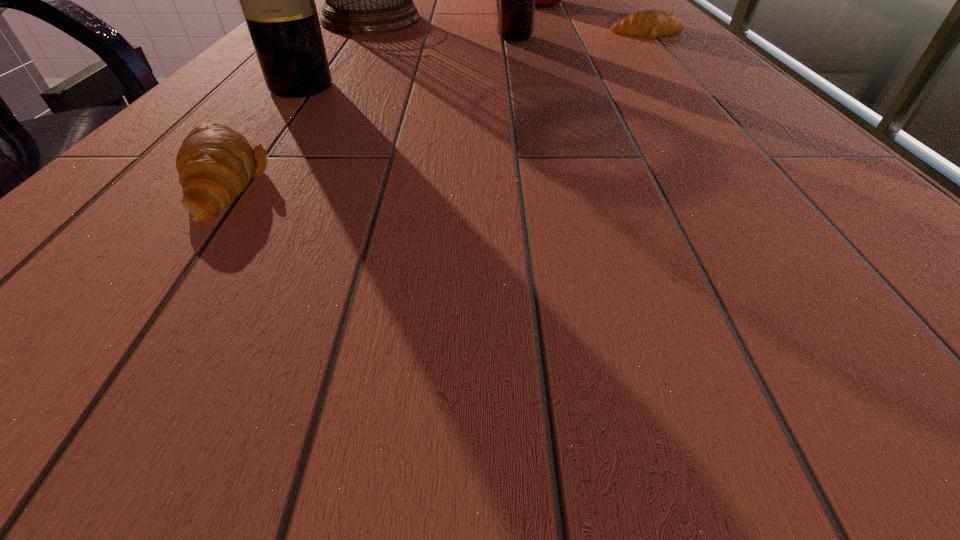
Where is `vacant space at the right edge of the desktop`? vacant space at the right edge of the desktop is located at coordinates (660, 50).

The width and height of the screenshot is (960, 540). I want to click on free space between the birdcage and the beer bottle, so click(x=443, y=29).

Where is `vacant space in between the beer bottle and the nearer crescent roll`? vacant space in between the beer bottle and the nearer crescent roll is located at coordinates (369, 110).

Find the location of a particular element. unoccupied position between the nearer crescent roll and the liquor is located at coordinates (261, 134).

Locate an element on the screen. This screenshot has height=540, width=960. free spot between the liquor and the right crescent roll is located at coordinates (475, 61).

The width and height of the screenshot is (960, 540). Identify the location of empty location between the shorter crescent roll and the beer bottle. (583, 37).

The image size is (960, 540). In order to click on the fifth closest object to the beer bottle in this screenshot , I will do `click(215, 163)`.

The width and height of the screenshot is (960, 540). I want to click on the closest object relative to the fire extinguisher, so click(650, 23).

Where is `vacant space that satisfies the following two spatial constraints: 1. on the front-facing side of the birdcage; 2. on the back side of the right crescent roll`? The width and height of the screenshot is (960, 540). vacant space that satisfies the following two spatial constraints: 1. on the front-facing side of the birdcage; 2. on the back side of the right crescent roll is located at coordinates (361, 35).

At what (x,y) coordinates should I click in order to perform the action: click on vacant space that satisfies the following two spatial constraints: 1. on the front-facing side of the right crescent roll; 2. on the left side of the birdcage. Please return your answer as a coordinate pair (x, y). Image resolution: width=960 pixels, height=540 pixels. Looking at the image, I should click on (361, 35).